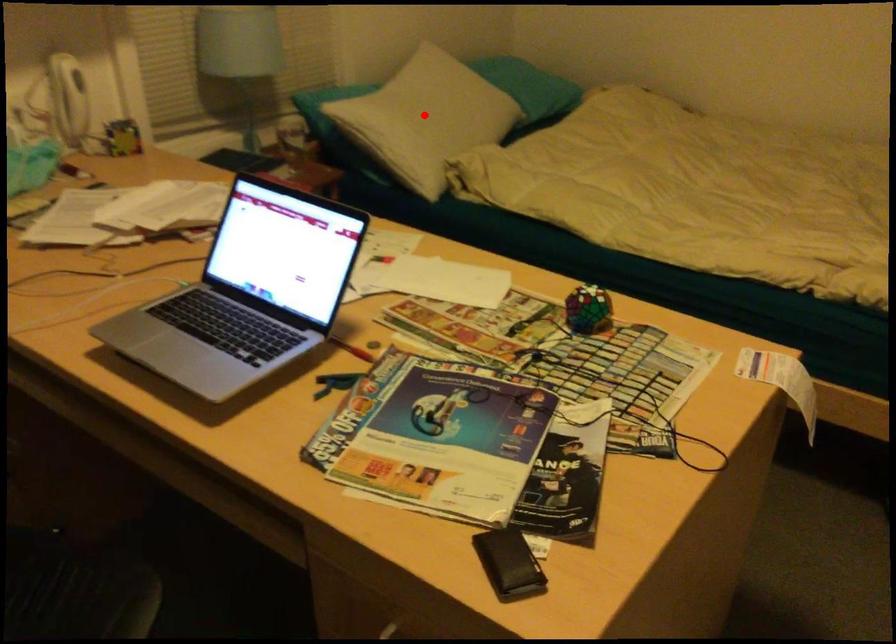
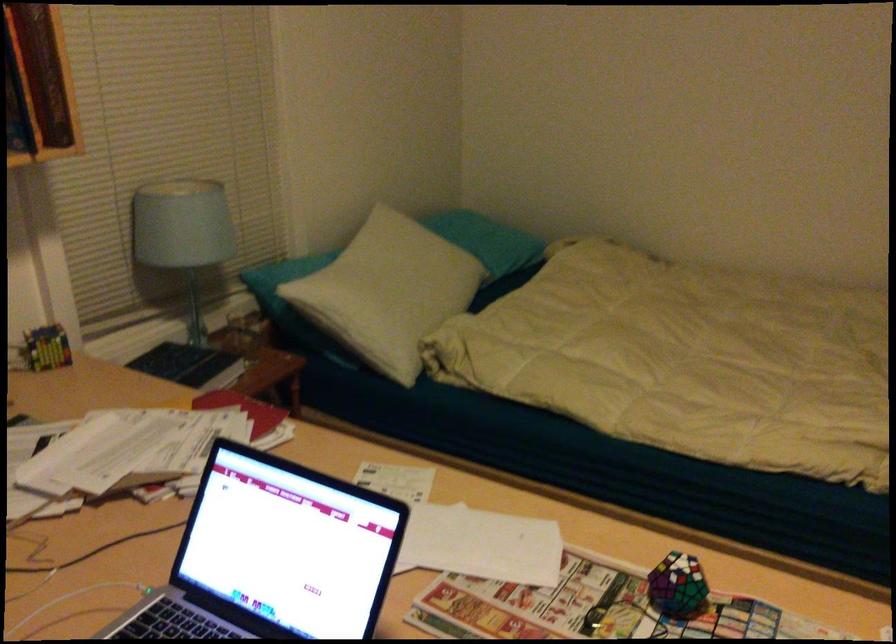
Question: A red point is marked in image1. In image2, is the corresponding 3D point closer to the camera or farther? Reply with the corresponding letter.

Choices:
 (A) The corresponding 3D point is closer.
 (B) The corresponding 3D point is farther.

Answer: (A)